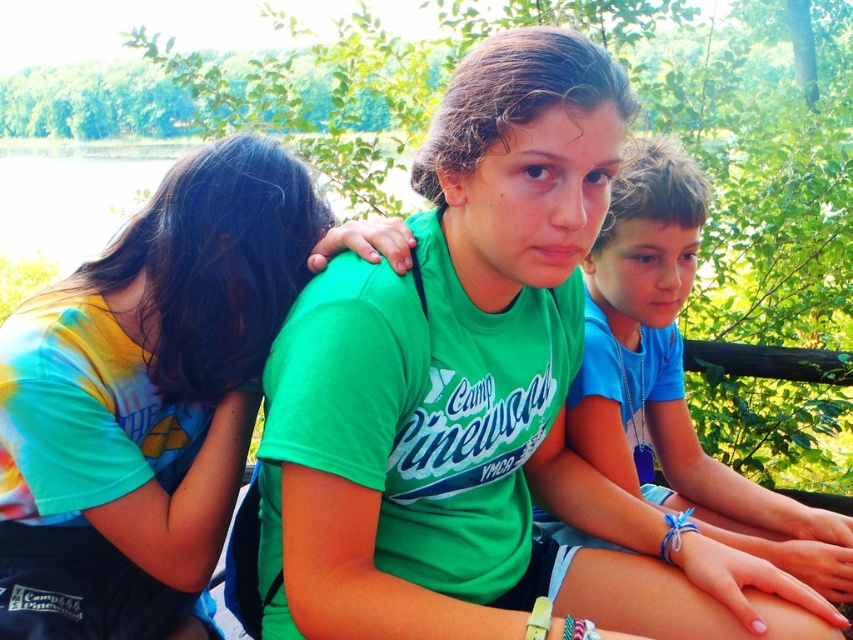
Question: Which object is the closest to the white string bracelet at lower right?

Choices:
 (A) green matte t-shirt at center
 (B) green cotton shirt at center

Answer: (B)

Question: Observing the image, what is the correct spatial positioning of green matte t-shirt at center in reference to green cotton shirt at center?

Choices:
 (A) above
 (B) below

Answer: (A)

Question: Which of the following is the closest to the observer?

Choices:
 (A) white rubber bracelet at lower center
 (B) blue rubber band at center
 (C) green matte t-shirt at center
 (D) tie-dye fabric shirt at left

Answer: (C)

Question: Can you confirm if tie-dye fabric shirt at left is positioned to the right of green cotton shirt at center?

Choices:
 (A) yes
 (B) no

Answer: (B)

Question: Does tie-dye fabric shirt at left appear under white rubber bracelet at lower center?

Choices:
 (A) no
 (B) yes

Answer: (A)

Question: Which point appears farthest from the camera in this image?

Choices:
 (A) (202, 307)
 (B) (270, 627)

Answer: (A)